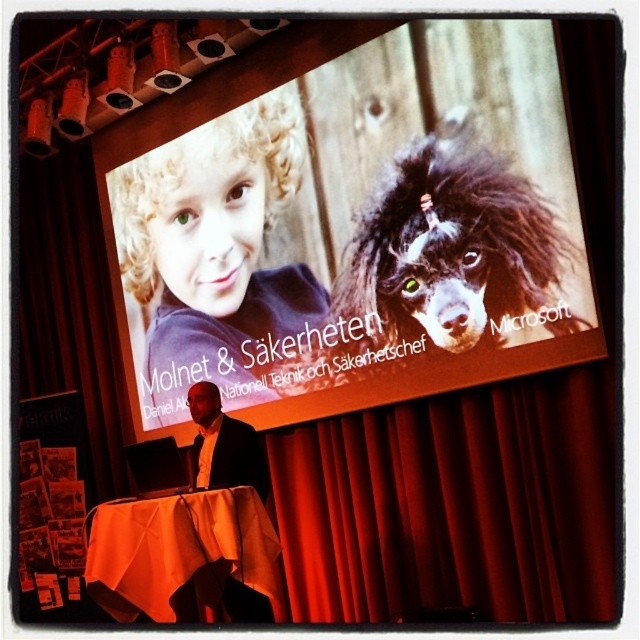
You are an attendee at the presentation. You notice the curly blonde hair at upper left and the orange fabric table at lower left. Which object appears bigger in the image?

The curly blonde hair at upper left appears larger compared to the orange fabric table at lower left.

You are a photographer in the audience and want to take a photo of the curly blonde hair at upper left and orange fabric table at lower left. Which object is positioned to the left of the other?

The curly blonde hair at upper left is positioned to the left of orange fabric table at lower left.

You are an event planner setting up a presentation. You need to ensure that the curly blonde hair at upper left and the orange fabric table at lower left are visible to the audience. Based on their sizes, which object might be more challenging to see from the back of the room?

The curly blonde hair at upper left is much taller than the orange fabric table at lower left, so it might be more visible from the back of the room. However, since the orange fabric table is at lower left, its position might also affect visibility. But based on size alone, the taller curly blonde hair at upper left is likely easier to see.